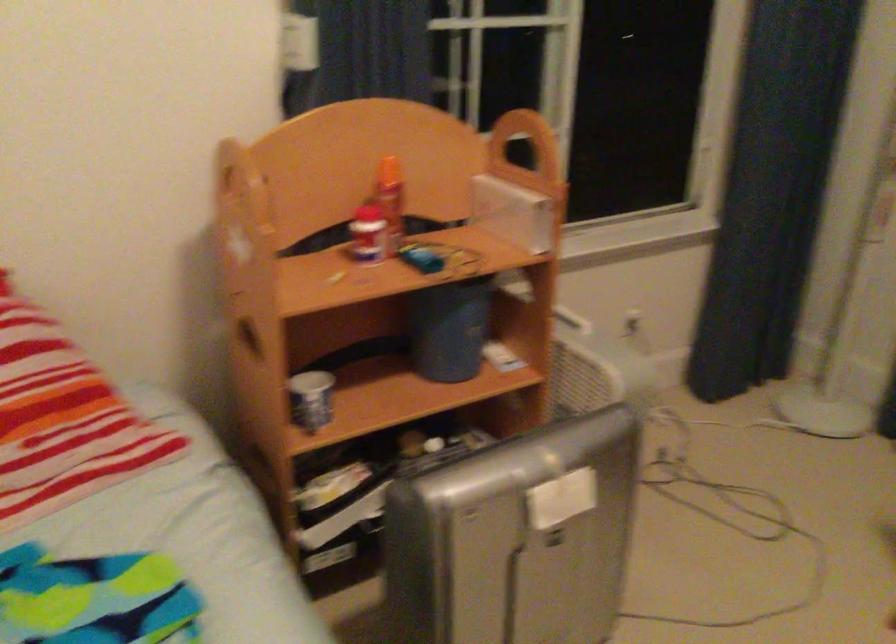
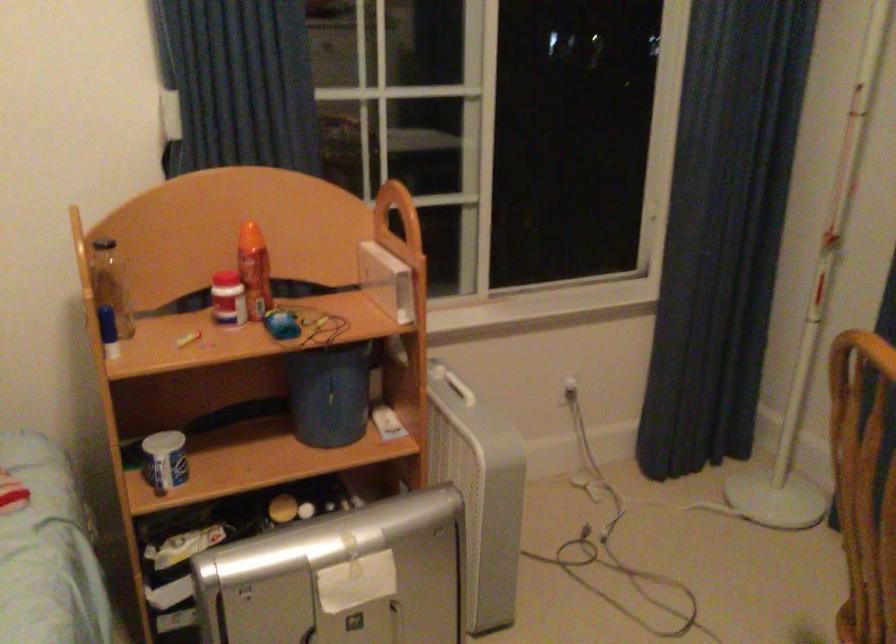
Locate, in the second image, the point that corresponds to the point at 312,401 in the first image.

(165, 460)